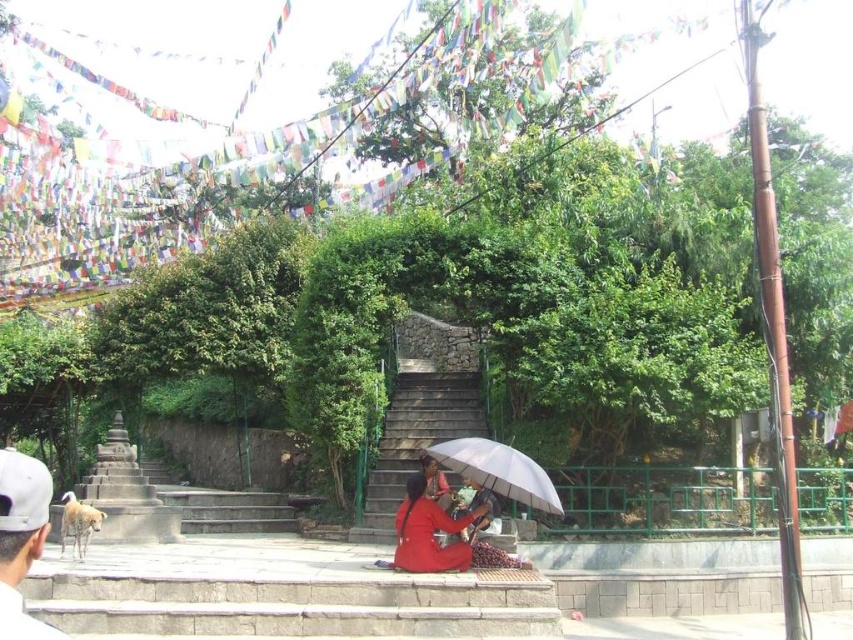
You are standing at the point marked by the coordinates point (x=415, y=440), which is labeled as stone stairs at center. Looking around, what is the nearest object to you in this scene?

The nearest object to you at point (x=415, y=440) is the stone stairs at center, as you are standing directly on them.